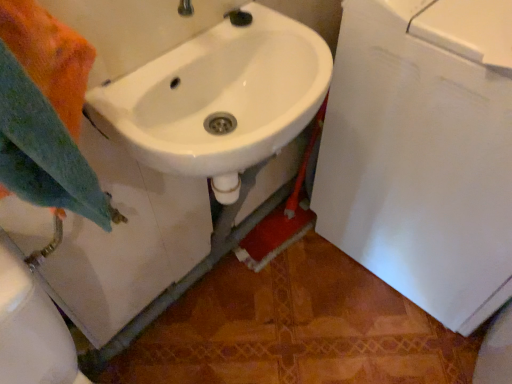
Question: Is point (31, 84) closer or farther from the camera than point (251, 79)?

Choices:
 (A) farther
 (B) closer

Answer: (B)

Question: In terms of width, does orange fabric towel at left look wider or thinner when compared to white glossy sink at center?

Choices:
 (A) thin
 (B) wide

Answer: (A)

Question: Is orange fabric towel at left taller or shorter than white glossy sink at center?

Choices:
 (A) tall
 (B) short

Answer: (A)

Question: From the image's perspective, relative to orange fabric towel at left, is white glossy sink at center above or below?

Choices:
 (A) above
 (B) below

Answer: (A)

Question: From a real-world perspective, relative to orange fabric towel at left, is white glossy sink at center vertically above or below?

Choices:
 (A) above
 (B) below

Answer: (B)

Question: Is white glossy sink at center bigger or smaller than orange fabric towel at left?

Choices:
 (A) big
 (B) small

Answer: (A)

Question: Considering the positions of white glossy sink at center and orange fabric towel at left in the image, is white glossy sink at center taller or shorter than orange fabric towel at left?

Choices:
 (A) tall
 (B) short

Answer: (B)